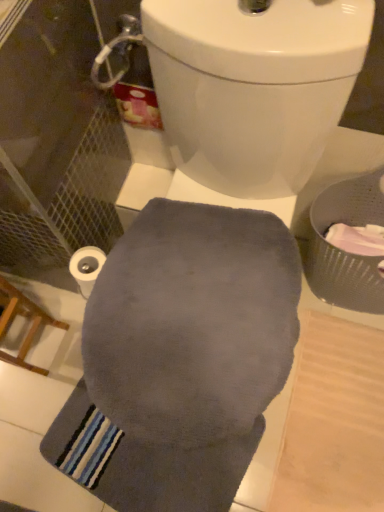
Question: Should I look upward or downward to see wooden chair at lower left?

Choices:
 (A) up
 (B) down

Answer: (B)

Question: Is wooden chair at lower left surrounding white matte toilet paper at lower left?

Choices:
 (A) no
 (B) yes

Answer: (A)

Question: Is wooden chair at lower left behind white matte toilet paper at lower left?

Choices:
 (A) no
 (B) yes

Answer: (A)

Question: Can you confirm if wooden chair at lower left is shorter than white matte toilet paper at lower left?

Choices:
 (A) yes
 (B) no

Answer: (B)

Question: From the image's perspective, is wooden chair at lower left located beneath white matte toilet paper at lower left?

Choices:
 (A) no
 (B) yes

Answer: (B)

Question: From a real-world perspective, is wooden chair at lower left over white matte toilet paper at lower left?

Choices:
 (A) yes
 (B) no

Answer: (B)

Question: Does wooden chair at lower left touch white matte toilet paper at lower left?

Choices:
 (A) no
 (B) yes

Answer: (A)

Question: Does gray woven basket at right lie behind wooden chair at lower left?

Choices:
 (A) yes
 (B) no

Answer: (A)

Question: Is gray woven basket at right smaller than wooden chair at lower left?

Choices:
 (A) no
 (B) yes

Answer: (B)

Question: Considering the relative sizes of gray woven basket at right and wooden chair at lower left in the image provided, is gray woven basket at right wider than wooden chair at lower left?

Choices:
 (A) no
 (B) yes

Answer: (B)

Question: From a real-world perspective, is gray woven basket at right physically below wooden chair at lower left?

Choices:
 (A) no
 (B) yes

Answer: (A)

Question: Does gray woven basket at right have a larger size compared to wooden chair at lower left?

Choices:
 (A) yes
 (B) no

Answer: (B)

Question: Is gray woven basket at right positioned in front of wooden chair at lower left?

Choices:
 (A) no
 (B) yes

Answer: (A)

Question: Is gray soft towel at center further to the viewer compared to gray woven basket at right?

Choices:
 (A) yes
 (B) no

Answer: (A)